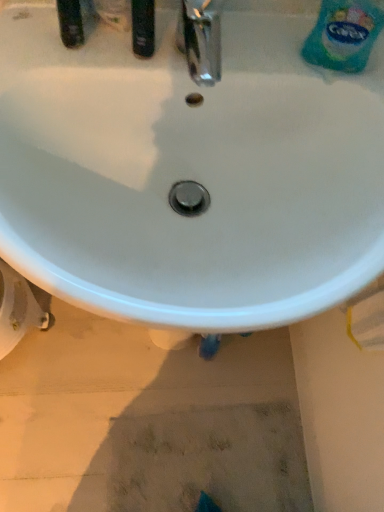
Question: Is white plastic bidet at lower left far away from white glossy sink at center?

Choices:
 (A) yes
 (B) no

Answer: (B)

Question: Does white plastic bidet at lower left turn towards white glossy sink at center?

Choices:
 (A) yes
 (B) no

Answer: (B)

Question: Is white plastic bidet at lower left touching white glossy sink at center?

Choices:
 (A) yes
 (B) no

Answer: (B)

Question: Considering the relative sizes of white plastic bidet at lower left and white glossy sink at center in the image provided, is white plastic bidet at lower left bigger than white glossy sink at center?

Choices:
 (A) no
 (B) yes

Answer: (A)

Question: Considering the relative sizes of white plastic bidet at lower left and white glossy sink at center in the image provided, is white plastic bidet at lower left wider than white glossy sink at center?

Choices:
 (A) no
 (B) yes

Answer: (A)

Question: From the image's perspective, is blue plastic bottle at upper right located above or below white plastic bidet at lower left?

Choices:
 (A) below
 (B) above

Answer: (B)

Question: Looking at the image, does blue plastic bottle at upper right seem bigger or smaller compared to white plastic bidet at lower left?

Choices:
 (A) big
 (B) small

Answer: (B)

Question: From a real-world perspective, relative to white plastic bidet at lower left, is blue plastic bottle at upper right vertically above or below?

Choices:
 (A) below
 (B) above

Answer: (B)

Question: Considering their positions, is blue plastic bottle at upper right located in front of or behind white plastic bidet at lower left?

Choices:
 (A) front
 (B) behind

Answer: (A)

Question: In terms of height, does white plastic bidet at lower left look taller or shorter compared to white glossy sink at center?

Choices:
 (A) short
 (B) tall

Answer: (A)

Question: From a real-world perspective, relative to white glossy sink at center, is white plastic bidet at lower left vertically above or below?

Choices:
 (A) above
 (B) below

Answer: (B)

Question: Relative to white glossy sink at center, is white plastic bidet at lower left in front or behind?

Choices:
 (A) front
 (B) behind

Answer: (B)

Question: Is white plastic bidet at lower left wider or thinner than white glossy sink at center?

Choices:
 (A) wide
 (B) thin

Answer: (B)

Question: From a real-world perspective, relative to blue plastic bottle at upper right, is white plastic bidet at lower left vertically above or below?

Choices:
 (A) below
 (B) above

Answer: (A)

Question: Considering the relative positions of white plastic bidet at lower left and blue plastic bottle at upper right in the image provided, is white plastic bidet at lower left to the left or to the right of blue plastic bottle at upper right?

Choices:
 (A) left
 (B) right

Answer: (A)